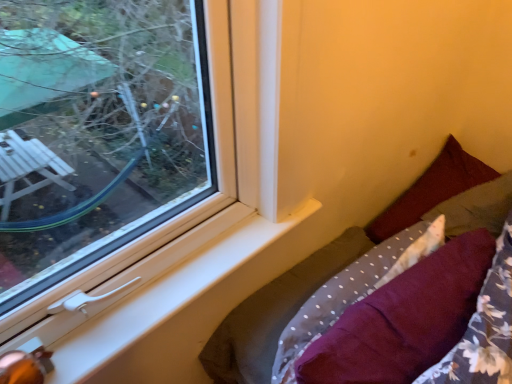
Question: Is maroon fabric pillow at right, arranged as the first pillow when viewed from the right, to the right of white plastic window sill at lower left from the viewer's perspective?

Choices:
 (A) yes
 (B) no

Answer: (A)

Question: Can we say maroon fabric pillow at right, which appears as the 3th pillow when viewed from the left, lies outside white plastic window sill at lower left?

Choices:
 (A) yes
 (B) no

Answer: (A)

Question: From the image's perspective, is maroon fabric pillow at right, arranged as the first pillow when viewed from the right, below white plastic window sill at lower left?

Choices:
 (A) no
 (B) yes

Answer: (A)

Question: Is maroon fabric pillow at right, which appears as the 3th pillow when viewed from the left, smaller than white plastic window sill at lower left?

Choices:
 (A) no
 (B) yes

Answer: (A)

Question: Does maroon fabric pillow at right, arranged as the first pillow when viewed from the right, have a lesser height compared to white plastic window sill at lower left?

Choices:
 (A) no
 (B) yes

Answer: (A)

Question: Is maroon fabric pillow at right, arranged as the first pillow when viewed from the right, to the left of white plastic window sill at lower left from the viewer's perspective?

Choices:
 (A) no
 (B) yes

Answer: (A)

Question: From a real-world perspective, is white plastic window sill at lower left below maroon fabric pillow at lower right, the third pillow viewed from the right?

Choices:
 (A) yes
 (B) no

Answer: (B)

Question: Does white plastic window sill at lower left have a smaller size compared to maroon fabric pillow at lower right, placed as the first pillow when sorted from left to right?

Choices:
 (A) yes
 (B) no

Answer: (A)

Question: Would you say white plastic window sill at lower left is outside maroon fabric pillow at lower right, placed as the first pillow when sorted from left to right?

Choices:
 (A) yes
 (B) no

Answer: (A)

Question: Is white plastic window sill at lower left aimed at maroon fabric pillow at lower right, the third pillow viewed from the right?

Choices:
 (A) no
 (B) yes

Answer: (B)

Question: From the image's perspective, is white plastic window sill at lower left above maroon fabric pillow at lower right, placed as the first pillow when sorted from left to right?

Choices:
 (A) no
 (B) yes

Answer: (B)

Question: Is white plastic window sill at lower left positioned before maroon fabric pillow at lower right, the third pillow viewed from the right?

Choices:
 (A) yes
 (B) no

Answer: (B)

Question: Is velvet burgundy pillow at lower right taller than maroon fabric pillow at right, the second pillow viewed from the right?

Choices:
 (A) no
 (B) yes

Answer: (B)